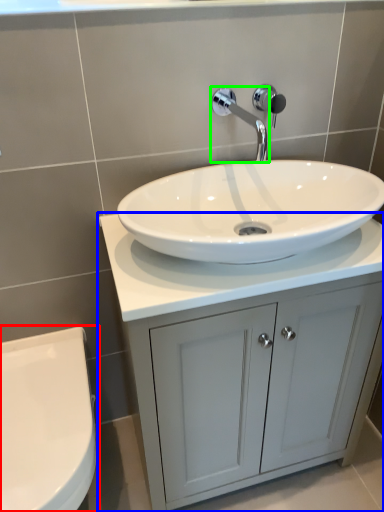
Question: Based on their relative distances, which object is farther from toilet (highlighted by a red box)? Choose from bathroom cabinet (highlighted by a blue box) and tap (highlighted by a green box).

Choices:
 (A) bathroom cabinet
 (B) tap

Answer: (B)